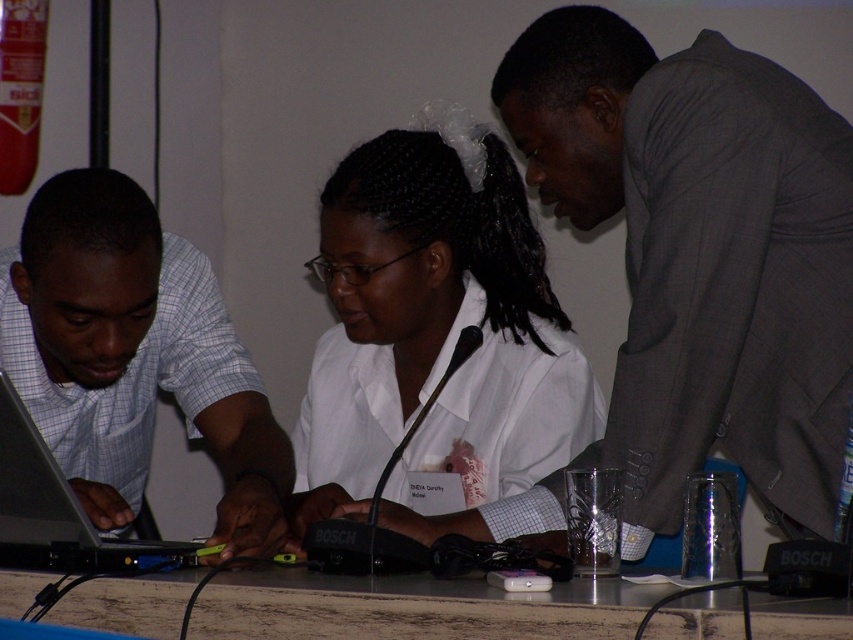
Can you confirm if white matte shirt at center is positioned above silver metallic laptop at left?

Indeed, white matte shirt at center is positioned over silver metallic laptop at left.

Does point (397, 195) come in front of point (67, 529)?

No, (397, 195) is behind (67, 529).

The height and width of the screenshot is (640, 853). I want to click on white matte shirt at center, so click(434, 326).

Can you confirm if light blue checkered shirt at left is positioned to the left of metallic gray table at center?

A: Correct, you'll find light blue checkered shirt at left to the left of metallic gray table at center.

Locate an element on the screen. The height and width of the screenshot is (640, 853). light blue checkered shirt at left is located at coordinates (132, 356).

Locate an element on the screen. Image resolution: width=853 pixels, height=640 pixels. light blue checkered shirt at left is located at coordinates (132, 356).

Which is behind, point (656, 403) or point (180, 280)?

Positioned behind is point (180, 280).

At what (x,y) coordinates should I click in order to perform the action: click on gray suit at upper right. Please return your answer as a coordinate pair (x, y). Image resolution: width=853 pixels, height=640 pixels. Looking at the image, I should click on (701, 256).